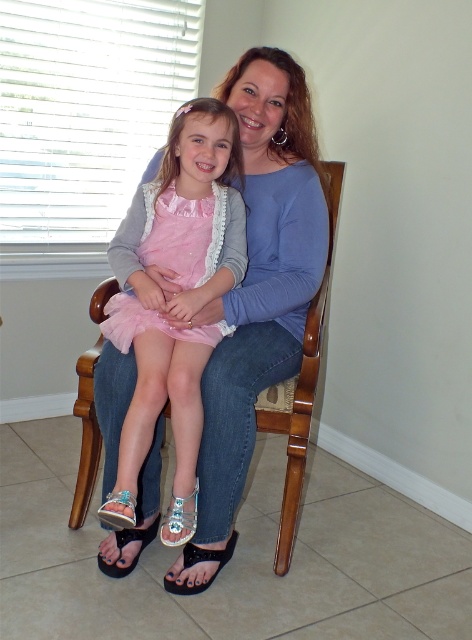
Question: Is pink tulle dress at center to the right of wooden armchair at center from the viewer's perspective?

Choices:
 (A) yes
 (B) no

Answer: (B)

Question: Among these objects, which one is nearest to the camera?

Choices:
 (A) shiny metallic sandal at lower left
 (B) black flip-flop at lower center
 (C) black fabric sandal at lower center

Answer: (A)

Question: Which object appears closest to the camera in this image?

Choices:
 (A) shiny metallic sandal at lower left
 (B) wooden armchair at center
 (C) pink tulle dress at center
 (D) black fabric sandal at lower center

Answer: (A)

Question: Can you confirm if black flip-flop at lower center is bigger than shiny metallic sandal at lower left?

Choices:
 (A) no
 (B) yes

Answer: (B)

Question: Where is metallic silver sandal at lower center located in relation to shiny metallic sandal at lower left in the image?

Choices:
 (A) below
 (B) above

Answer: (A)

Question: Which object is the farthest from the pink tulle dress at center?

Choices:
 (A) metallic silver sandal at lower center
 (B) shiny metallic sandal at lower left

Answer: (B)